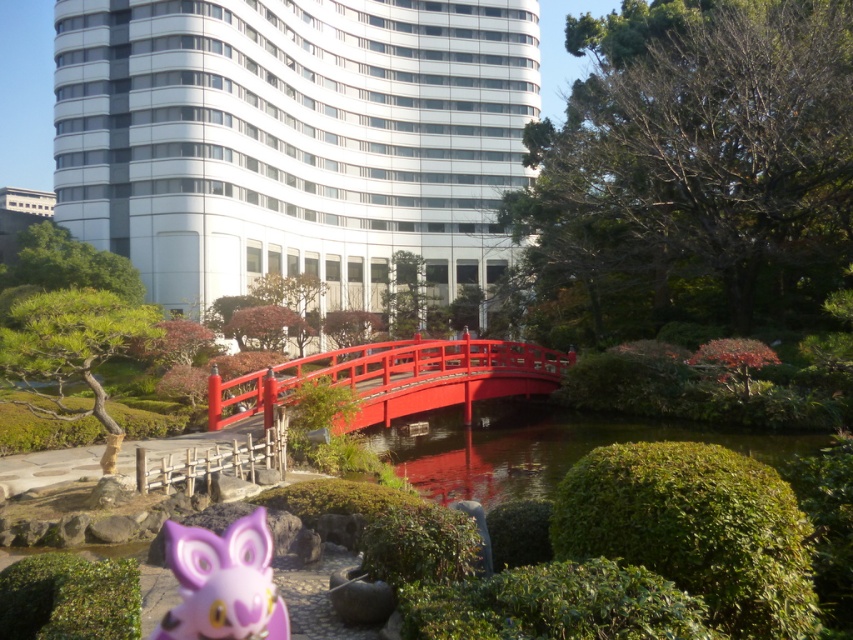
Who is positioned more to the right, green glossy pond at center or glossy wood bridge at center?

green glossy pond at center is more to the right.

What are the coordinates of `green glossy pond at center` in the screenshot? It's located at (543, 445).

Is point (440, 484) farther from camera compared to point (422, 376)?

No, it is in front of (422, 376).

Image resolution: width=853 pixels, height=640 pixels. Identify the location of green glossy pond at center. (543, 445).

Between green glossy pond at center and purple matte plush toy at lower left, which one appears on the right side from the viewer's perspective?

Positioned to the right is green glossy pond at center.

Which is behind, point (780, 435) or point (222, 618)?

The point (780, 435) is more distant.

Is point (782, 465) positioned after point (265, 636)?

Yes, it is.

Find the location of `green glossy pond at center`. green glossy pond at center is located at coordinates (543, 445).

Is glossy wood bridge at center below purple matte plush toy at lower left?

Incorrect, glossy wood bridge at center is not positioned below purple matte plush toy at lower left.

Locate an element on the screen. glossy wood bridge at center is located at coordinates (395, 378).